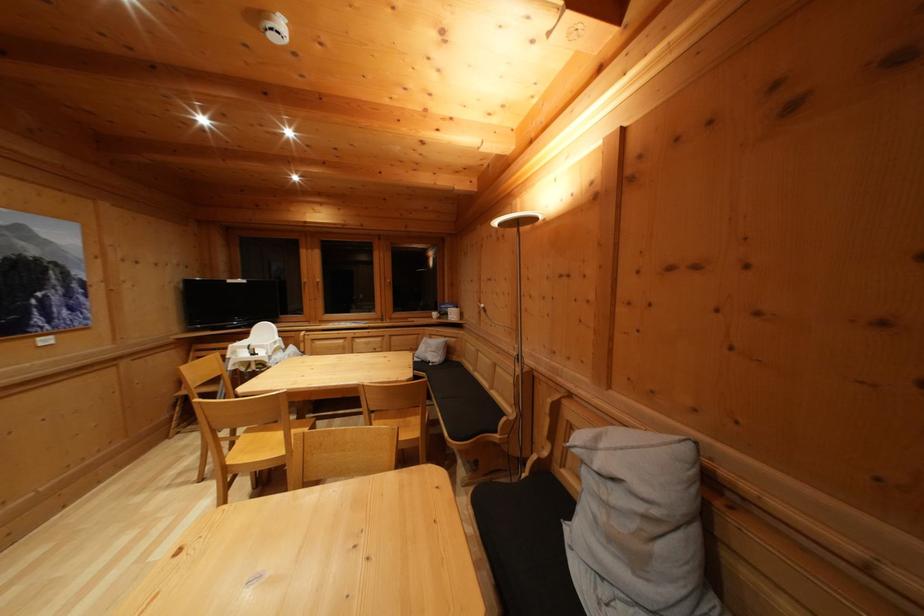
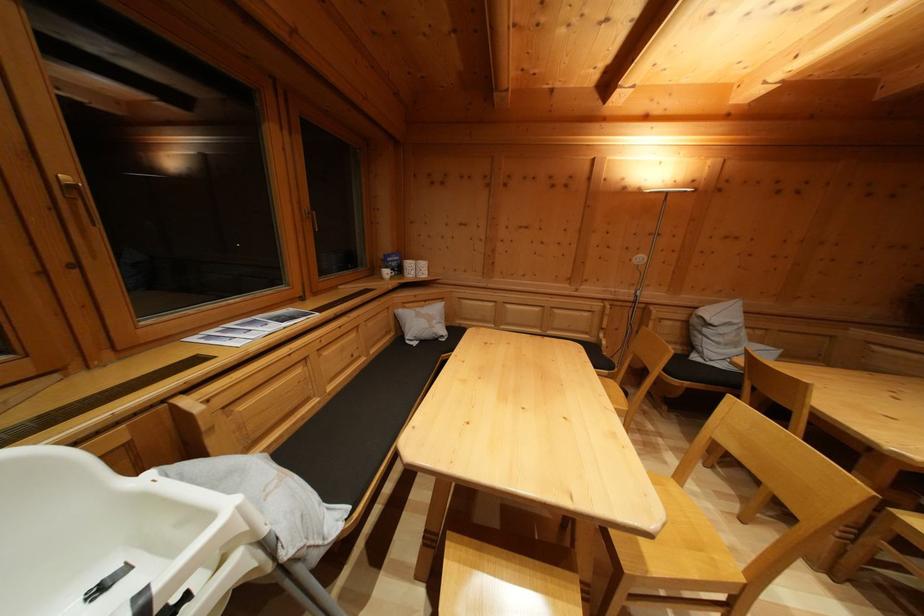
In the second image, find the point that corresponds to pixel 451 344 in the first image.

(431, 308)